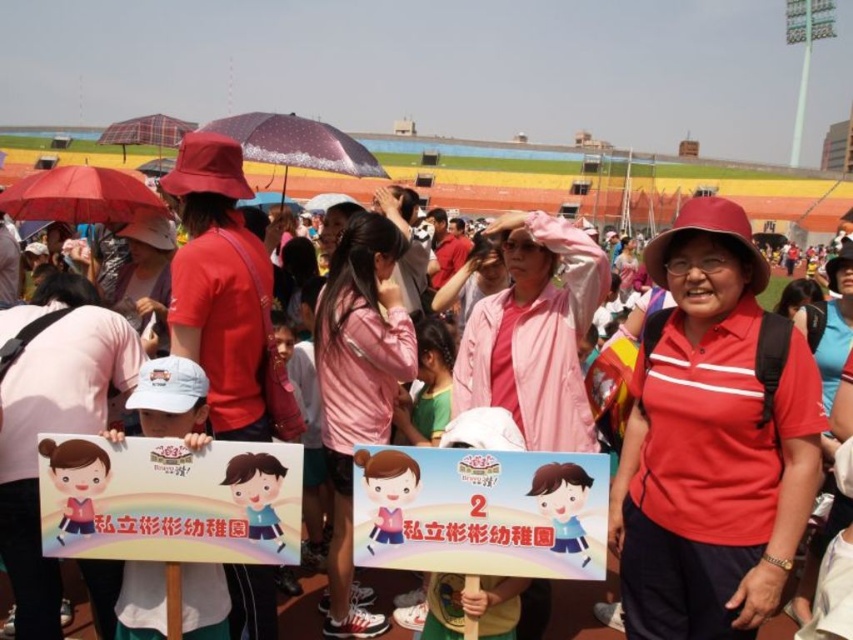
Does point (85, 209) come farther from viewer compared to point (236, 122)?

No, (85, 209) is closer to viewer.

The image size is (853, 640). Describe the element at coordinates (79, 196) in the screenshot. I see `matte red umbrella at left` at that location.

Locate an element on the screen. This screenshot has height=640, width=853. matte red umbrella at left is located at coordinates (79, 196).

Can you confirm if pink fabric jacket at center is bigger than matte red umbrella at left?

No, pink fabric jacket at center is not bigger than matte red umbrella at left.

Is pink fabric jacket at center thinner than matte red umbrella at left?

Indeed, pink fabric jacket at center has a lesser width compared to matte red umbrella at left.

Is point (390, 230) more distant than point (38, 204)?

No, (390, 230) is in front of (38, 204).

You are a GUI agent. You are given a task and a screenshot of the screen. Output one action in this format:
    pyautogui.click(x=<x>, y=<y>)
    Task: Click on the pink fabric jacket at center
    This screenshot has width=853, height=640.
    Given the screenshot: What is the action you would take?
    pyautogui.click(x=358, y=388)

Can you confirm if pink fabric jacket at center is thinner than sparkly purple umbrella at center?

Yes, pink fabric jacket at center is thinner than sparkly purple umbrella at center.

Does pink fabric jacket at center have a greater width compared to sparkly purple umbrella at center?

No.

Which is in front, point (369, 365) or point (283, 186)?

Point (369, 365) is more forward.

This screenshot has height=640, width=853. I want to click on pink fabric jacket at center, so click(358, 388).